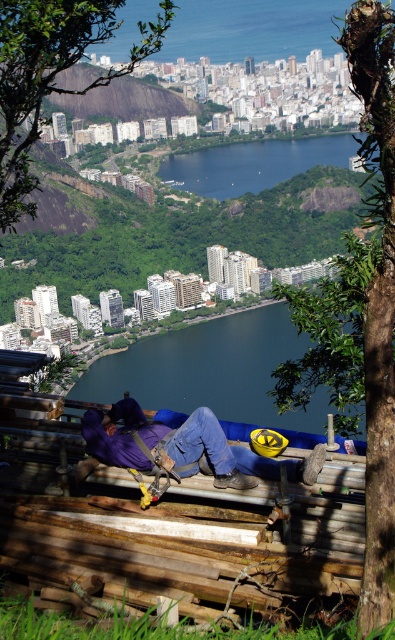
Is dark blue water at center positioned in front of blue glassy water at center?

Yes.

Is point (150, 353) closer to viewer compared to point (214, 173)?

Yes, point (150, 353) is in front of point (214, 173).

Which is in front, point (214, 358) or point (272, 148)?

Point (214, 358) is more forward.

At what (x,y) coordinates should I click in order to perform the action: click on dark blue water at center. Please return your answer as a coordinate pair (x, y). Image resolution: width=395 pixels, height=640 pixels. Looking at the image, I should click on (210, 371).

Does dark blue water at center appear under purple fabric at center?

Incorrect, dark blue water at center is not positioned below purple fabric at center.

Which is below, dark blue water at center or purple fabric at center?

Positioned lower is purple fabric at center.

Identify the location of dark blue water at center. (210, 371).

Does purple fabric at center appear under blue glassy water at center?

Yes, purple fabric at center is below blue glassy water at center.

Where is `purple fabric at center`? purple fabric at center is located at coordinates (186, 448).

You are a GUI agent. You are given a task and a screenshot of the screen. Output one action in this format:
    pyautogui.click(x=<x>, y=<y>)
    Task: Click on the purple fabric at center
    
    Given the screenshot: What is the action you would take?
    pyautogui.click(x=186, y=448)